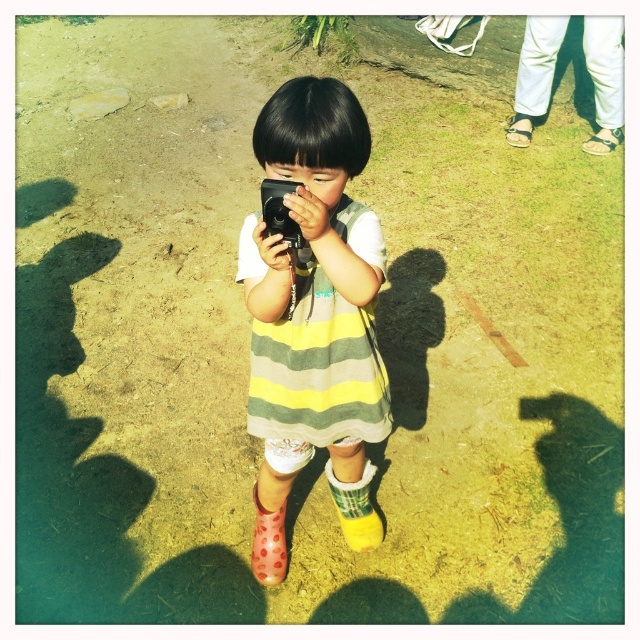
Based on the photo, you are a photographer trying to capture the child in the striped dress with the camera. The white leather sandals at upper right is represented by point (604,80). Where should you position yourself to include both the child and the white leather sandals at upper right in your photo?

Position yourself such that the white leather sandals at upper right, located at point (604,80), is within the frame along with the child in the striped dress. Ensure your camera angle captures both elements by framing the scene to include the lower area where the child stands and the upper right corner where the sandals are positioned.

You are a photographer trying to capture the scene with your camera. You notice the white leather sandals at upper right and the black plastic camera at center. Which object is larger in the image?

The white leather sandals at upper right is bigger than the black plastic camera at center.